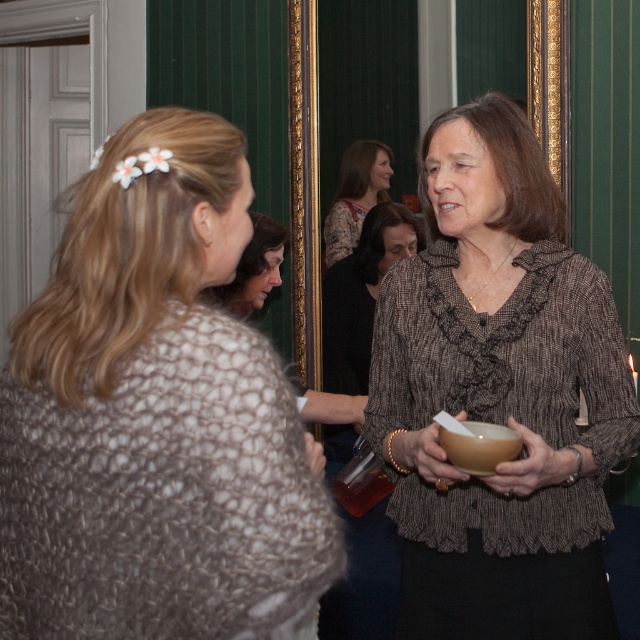
Does brown textured blouse at center have a lesser height compared to matte black hair at center?

No, brown textured blouse at center is not shorter than matte black hair at center.

Which is above, brown textured blouse at center or matte black hair at center?

matte black hair at center is above.

Which is in front, point (468, 484) or point (268, 218)?

Point (468, 484) is more forward.

Identify the location of brown textured blouse at center. (499, 394).

The width and height of the screenshot is (640, 640). Describe the element at coordinates (156, 417) in the screenshot. I see `knitted beige sweater at center` at that location.

Is knitted beige sweater at center above brown textured blouse at center?

Actually, knitted beige sweater at center is below brown textured blouse at center.

Between point (177, 284) and point (397, 401), which one is positioned behind?

The point (397, 401) is behind.

This screenshot has width=640, height=640. Identify the location of knitted beige sweater at center. (156, 417).

Describe the element at coordinates (356, 195) in the screenshot. I see `floral-patterned blouse at center` at that location.

Identify the location of floral-patterned blouse at center. The width and height of the screenshot is (640, 640). (356, 195).

Find the location of a particular element. floral-patterned blouse at center is located at coordinates (356, 195).

The width and height of the screenshot is (640, 640). I want to click on floral-patterned blouse at center, so click(356, 195).